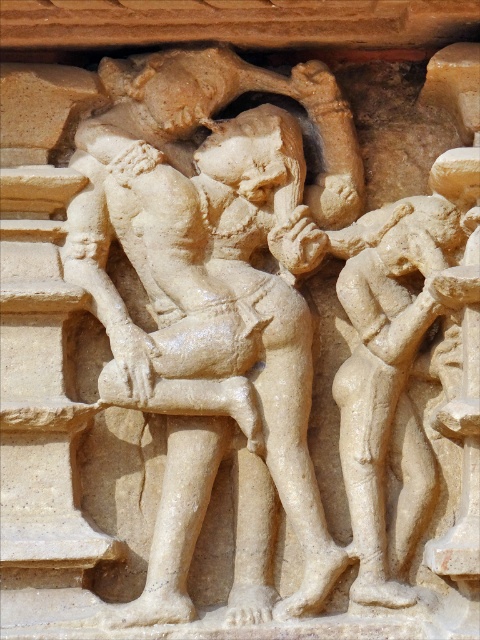
Question: Is the position of beige stone sculpture at center less distant than that of beige stone figure at right?

Choices:
 (A) no
 (B) yes

Answer: (B)

Question: Is beige stone sculpture at center below beige stone figure at right?

Choices:
 (A) yes
 (B) no

Answer: (B)

Question: Which point appears farthest from the camera in this image?

Choices:
 (A) (408, 352)
 (B) (301, 369)

Answer: (B)

Question: Does beige stone sculpture at center appear over beige stone figure at right?

Choices:
 (A) yes
 (B) no

Answer: (A)

Question: Which point is closer to the camera?

Choices:
 (A) (276, 380)
 (B) (436, 216)

Answer: (A)

Question: Which point is farther from the camera taking this photo?

Choices:
 (A) (372, 544)
 (B) (164, 211)

Answer: (B)